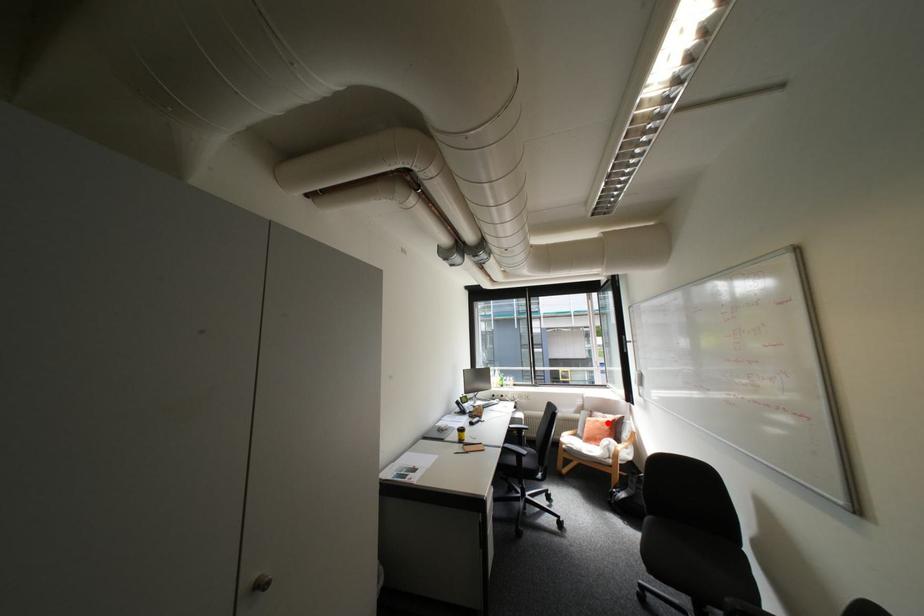
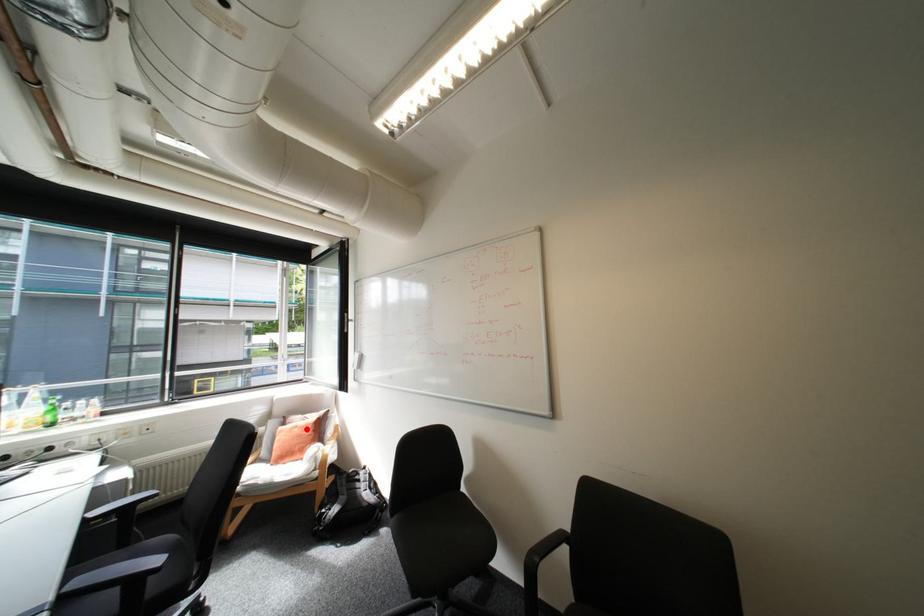
I am providing you with two images of the same scene from different viewpoints. A red point is marked on the first image and another point is marked on the second image. Are the points marked in image1 and image2 representing the same 3D position?

Yes